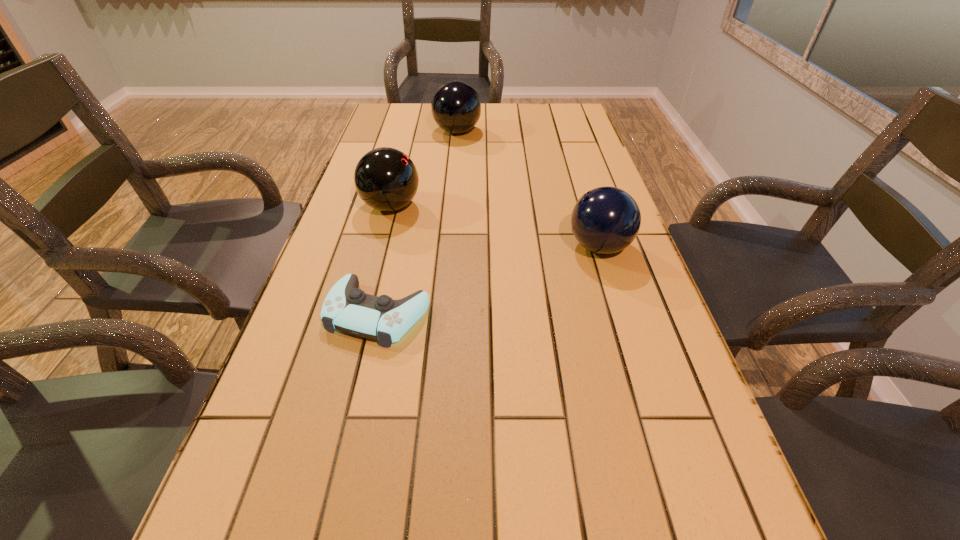
I want to click on vacant space in between the rightmost object and the second nearest bowling ball, so click(495, 227).

In order to click on unoccupied position between the farthest object and the shortest object in this screenshot , I will do `click(418, 222)`.

Find the location of a particular element. The height and width of the screenshot is (540, 960). free spot between the nearest bowling ball and the farthest object is located at coordinates (528, 189).

What are the coordinates of `free spot between the second farthest object and the nearest object` in the screenshot? It's located at (385, 260).

The height and width of the screenshot is (540, 960). Find the location of `free space between the shortest object and the farthest bowling ball`. free space between the shortest object and the farthest bowling ball is located at coordinates (418, 222).

This screenshot has width=960, height=540. I want to click on free area in between the second farthest object and the rightmost bowling ball, so click(495, 227).

The height and width of the screenshot is (540, 960). What are the coordinates of `free space between the second farthest object and the farthest bowling ball` in the screenshot? It's located at (424, 169).

The image size is (960, 540). Identify the location of vacant space that's between the shortest object and the nearest bowling ball. (489, 280).

Find the location of a particular element. free space between the farthest bowling ball and the control is located at coordinates (418, 222).

Find the location of a particular element. This screenshot has height=540, width=960. vacant region between the control and the second nearest bowling ball is located at coordinates (385, 260).